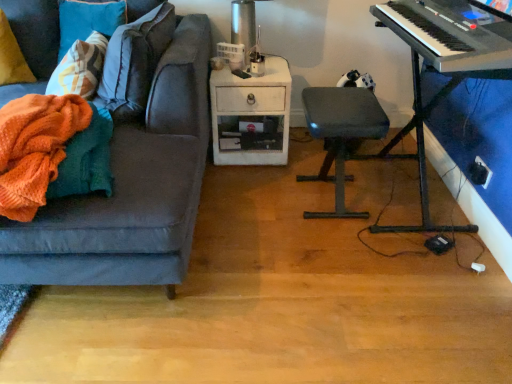
Find the location of `free space below black plastic keyboard at right (from a real-world perspective)`. free space below black plastic keyboard at right (from a real-world perspective) is located at coordinates (402, 197).